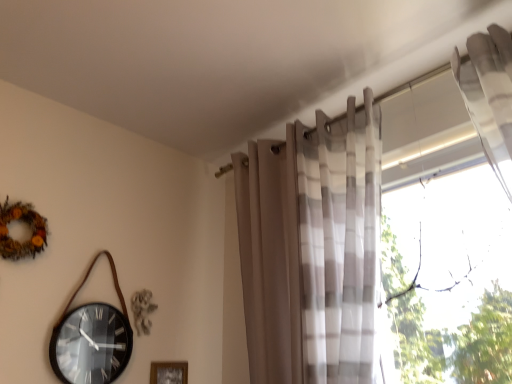
Question: Can you confirm if wooden frame at lower center is smaller than transparent glass window at right?

Choices:
 (A) yes
 (B) no

Answer: (A)

Question: Is wooden frame at lower center further to the viewer compared to transparent glass window at right?

Choices:
 (A) yes
 (B) no

Answer: (A)

Question: Does wooden frame at lower center contain transparent glass window at right?

Choices:
 (A) yes
 (B) no

Answer: (B)

Question: Is wooden frame at lower center thinner than transparent glass window at right?

Choices:
 (A) yes
 (B) no

Answer: (A)

Question: Does wooden frame at lower center have a greater width compared to transparent glass window at right?

Choices:
 (A) no
 (B) yes

Answer: (A)

Question: Would you say transparent glass window at right is inside or outside translucent sheer curtain at upper right?

Choices:
 (A) inside
 (B) outside

Answer: (B)

Question: In terms of height, does transparent glass window at right look taller or shorter compared to translucent sheer curtain at upper right?

Choices:
 (A) short
 (B) tall

Answer: (A)

Question: Visually, is transparent glass window at right positioned to the left or to the right of translucent sheer curtain at upper right?

Choices:
 (A) right
 (B) left

Answer: (A)

Question: From a real-world perspective, is transparent glass window at right above or below translucent sheer curtain at upper right?

Choices:
 (A) below
 (B) above

Answer: (A)

Question: In the image, is wooden frame at lower center positioned in front of or behind transparent glass window at right?

Choices:
 (A) front
 (B) behind

Answer: (B)

Question: Considering the positions of wooden frame at lower center and transparent glass window at right in the image, is wooden frame at lower center bigger or smaller than transparent glass window at right?

Choices:
 (A) small
 (B) big

Answer: (A)

Question: From their relative heights in the image, would you say wooden frame at lower center is taller or shorter than transparent glass window at right?

Choices:
 (A) short
 (B) tall

Answer: (A)

Question: Is wooden frame at lower center inside the boundaries of transparent glass window at right, or outside?

Choices:
 (A) inside
 (B) outside

Answer: (B)

Question: Is transparent glass window at right to the left or to the right of wooden frame at lower center in the image?

Choices:
 (A) left
 (B) right

Answer: (B)

Question: From the image's perspective, relative to wooden frame at lower center, is transparent glass window at right above or below?

Choices:
 (A) above
 (B) below

Answer: (A)